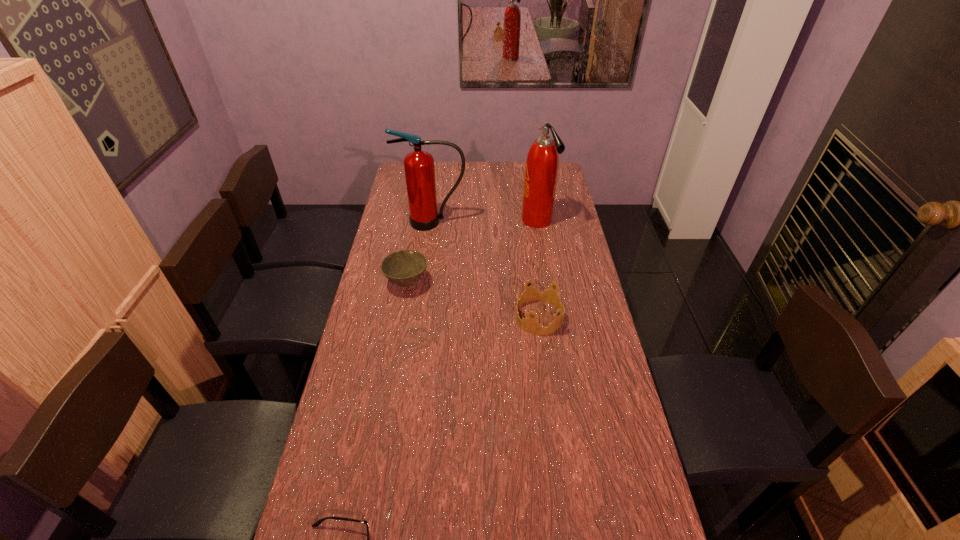
You are a GUI agent. You are given a task and a screenshot of the screen. Output one action in this format:
    pyautogui.click(x=<x>, y=<y>)
    Task: Click on the free spot between the third nearest object and the second nearest object
    
    Given the screenshot: What is the action you would take?
    pyautogui.click(x=473, y=300)

In order to click on free space between the bowl and the right fire extinguisher in this screenshot , I will do `click(472, 252)`.

Image resolution: width=960 pixels, height=540 pixels. Identify the location of empty space that is in between the tiara and the bowl. (473, 300).

At what (x,y) coordinates should I click in order to perform the action: click on vacant area between the fourth farthest object and the bowl. Please return your answer as a coordinate pair (x, y). The height and width of the screenshot is (540, 960). Looking at the image, I should click on (473, 300).

Where is `free space between the fourth farthest object and the right fire extinguisher`? The height and width of the screenshot is (540, 960). free space between the fourth farthest object and the right fire extinguisher is located at coordinates coord(538,269).

Choose which object is the fourth nearest neighbor to the fourth farthest object. Please provide its 2D coordinates. Your answer should be formatted as a tuple, i.e. [(x, y)], where the tuple contains the x and y coordinates of a point satisfying the conditions above.

[(320, 521)]

You are a GUI agent. You are given a task and a screenshot of the screen. Output one action in this format:
    pyautogui.click(x=<x>, y=<y>)
    Task: Click on the object that is the closest to the spectacles
    
    Given the screenshot: What is the action you would take?
    pyautogui.click(x=530, y=325)